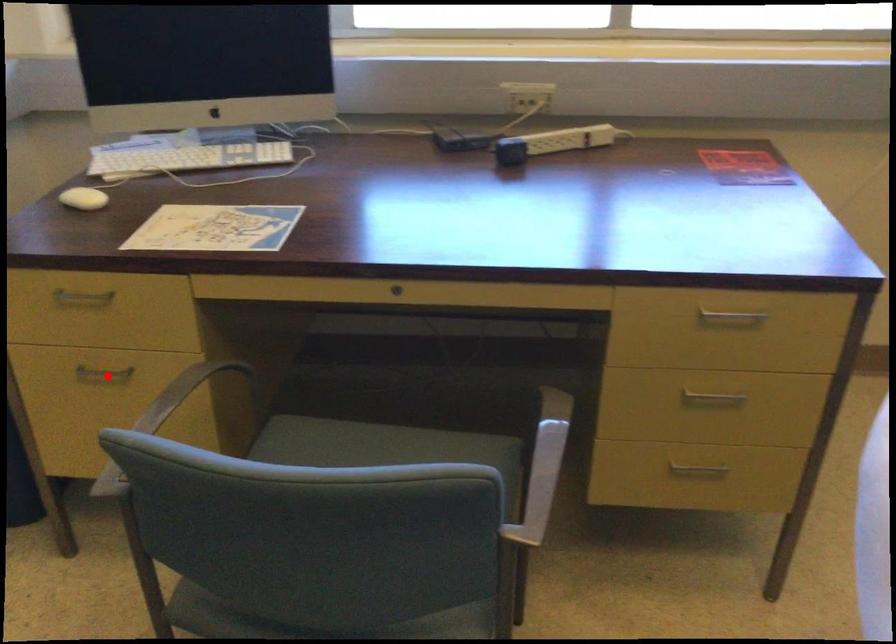
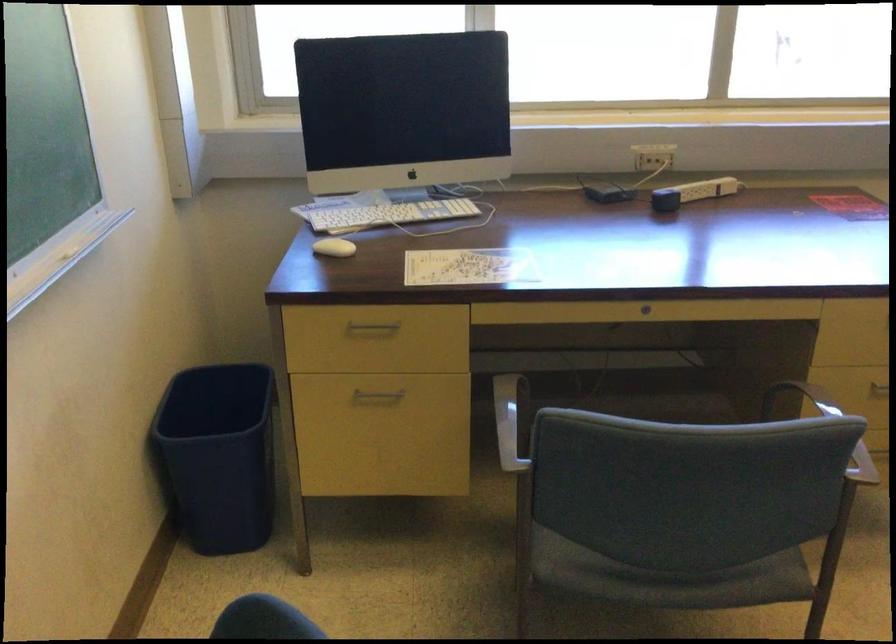
The point at the highlighted location is marked in the first image. Where is the corresponding point in the second image?

(376, 395)